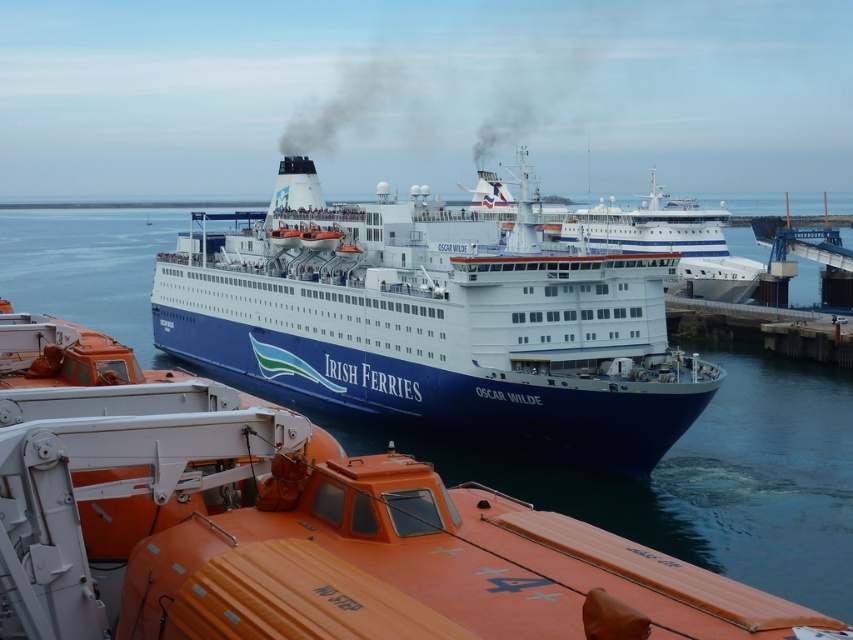
From the picture: Can you confirm if blue water at center is shorter than black smoke at center?

Yes.

Which is below, blue water at center or black smoke at center?

blue water at center is below.

Which is behind, point (840, 536) or point (650, 60)?

The point (650, 60) is more distant.

I want to click on blue water at center, so click(704, 477).

Can you confirm if blue matte ferry at center is smaller than blue water at center?

Indeed, blue matte ferry at center has a smaller size compared to blue water at center.

Who is more distant from viewer, [241,289] or [581,486]?

Point [241,289]

I want to click on blue matte ferry at center, so click(434, 324).

Locate an element on the screen. Image resolution: width=853 pixels, height=640 pixels. blue matte ferry at center is located at coordinates (434, 324).

Does blue matte ferry at center appear on the right side of black smoke at center?

Incorrect, blue matte ferry at center is not on the right side of black smoke at center.

Can you confirm if blue matte ferry at center is wider than black smoke at center?

Incorrect, blue matte ferry at center's width does not surpass black smoke at center's.

Between point (268, 285) and point (334, 125), which one is positioned in front?

Point (268, 285) is in front.

The width and height of the screenshot is (853, 640). What are the coordinates of `blue matte ferry at center` in the screenshot? It's located at (434, 324).